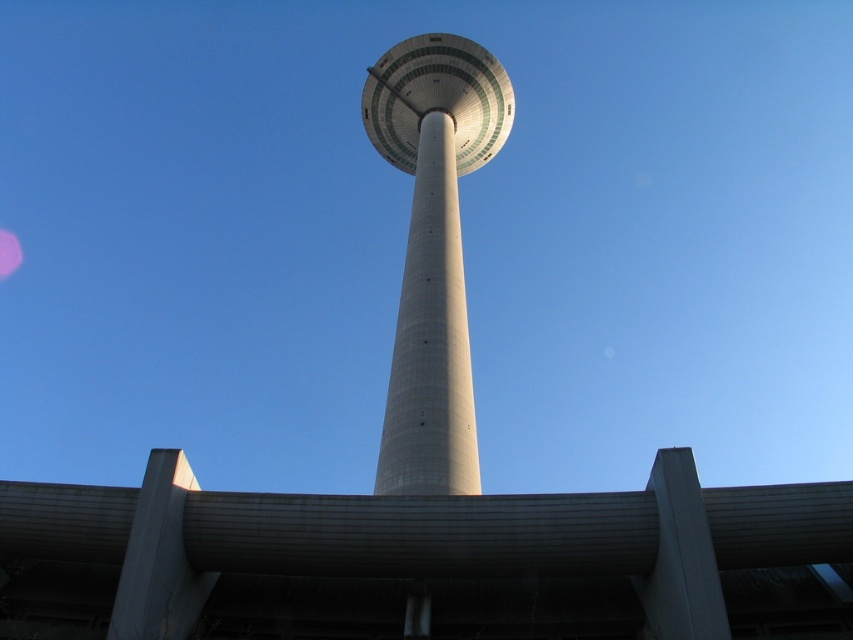
You are standing at the base of the tower and want to place a small flag exactly at the point marked by the coordinates point (433,250). Given the tower is a white concrete tower at center, can you determine if this point is on the tower itself?

The point (433,250) indicates the white concrete tower at center, so yes, the point is located on the tower itself.

From the picture: You are standing in front of the tower and want to determine which of the two points, point (x=672, y=552) or point (x=433, y=58), is closer to you. Based on the image, which point is nearer?

Point (x=672, y=552) is closer to the viewer than point (x=433, y=58).

What is the exact coordinate of the concrete at center in the image?

The concrete at center is located at coordinate point (425,561).